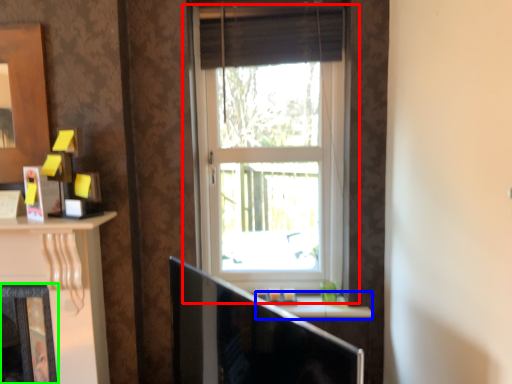
Question: Which object is the farthest from window (highlighted by a red box)? Choose among these: window sill (highlighted by a blue box) or fireplace (highlighted by a green box).

Choices:
 (A) window sill
 (B) fireplace

Answer: (B)